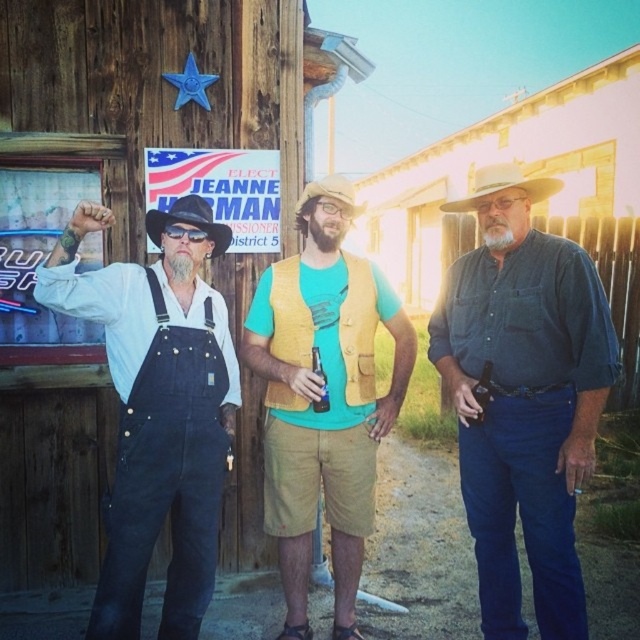
Can you confirm if denim shirt at center is smaller than white felt cowboy hat at center?

Incorrect, denim shirt at center is not smaller in size than white felt cowboy hat at center.

Can you confirm if denim shirt at center is shorter than white felt cowboy hat at center?

No, denim shirt at center is not shorter than white felt cowboy hat at center.

You are a GUI agent. You are given a task and a screenshot of the screen. Output one action in this format:
    pyautogui.click(x=<x>, y=<y>)
    Task: Click on the denim shirt at center
    The image size is (640, 640).
    Given the screenshot: What is the action you would take?
    pyautogui.click(x=524, y=397)

Find the location of a particular element. This screenshot has width=640, height=640. denim shirt at center is located at coordinates (524, 397).

Looking at this image, who is lower down, denim shirt at center or yellow textured vest at center?

yellow textured vest at center is lower down.

Can you confirm if denim shirt at center is shorter than yellow textured vest at center?

Incorrect, denim shirt at center's height does not fall short of yellow textured vest at center's.

Does point (545, 502) come behind point (353, 404)?

That is False.

This screenshot has height=640, width=640. What are the coordinates of `denim shirt at center` in the screenshot? It's located at (524, 397).

Is denim shirt at center closer to camera compared to brown felt cowboy hat at center?

Yes.

Measure the distance between denim shirt at center and brown felt cowboy hat at center.

3.66 feet

Describe the element at coordinates (524, 397) in the screenshot. I see `denim shirt at center` at that location.

Identify the location of denim shirt at center. (524, 397).